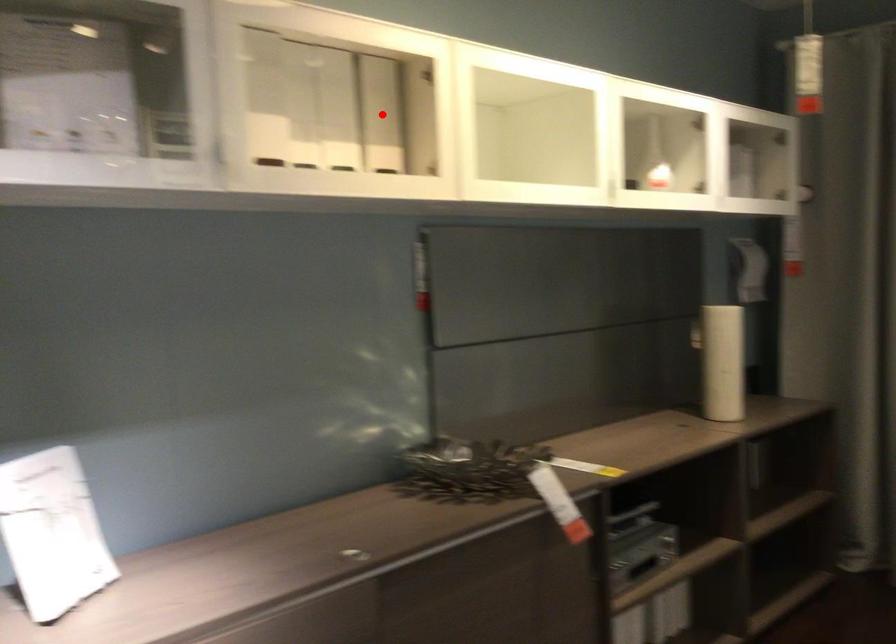
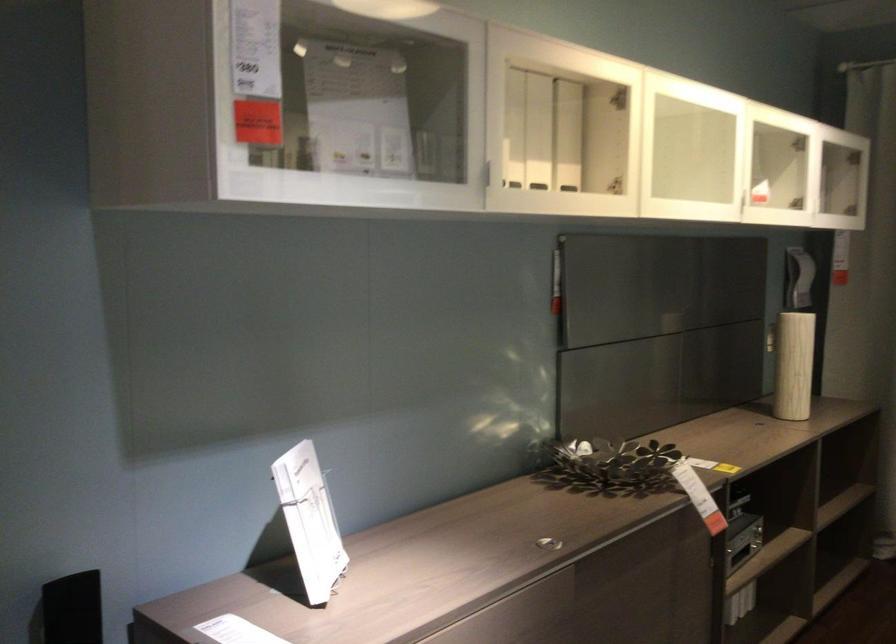
Locate, in the second image, the point that corresponds to the highlighted location in the first image.

(567, 135)